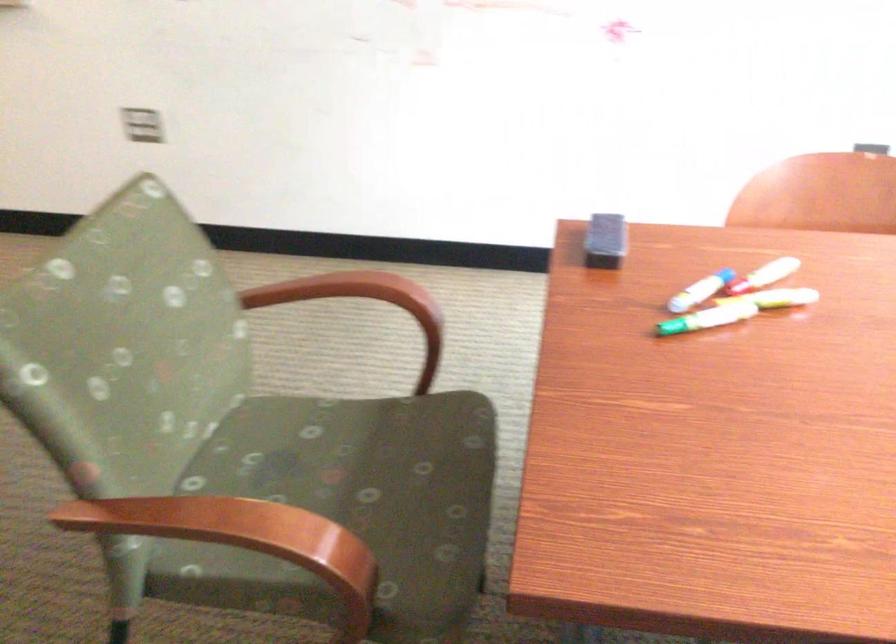
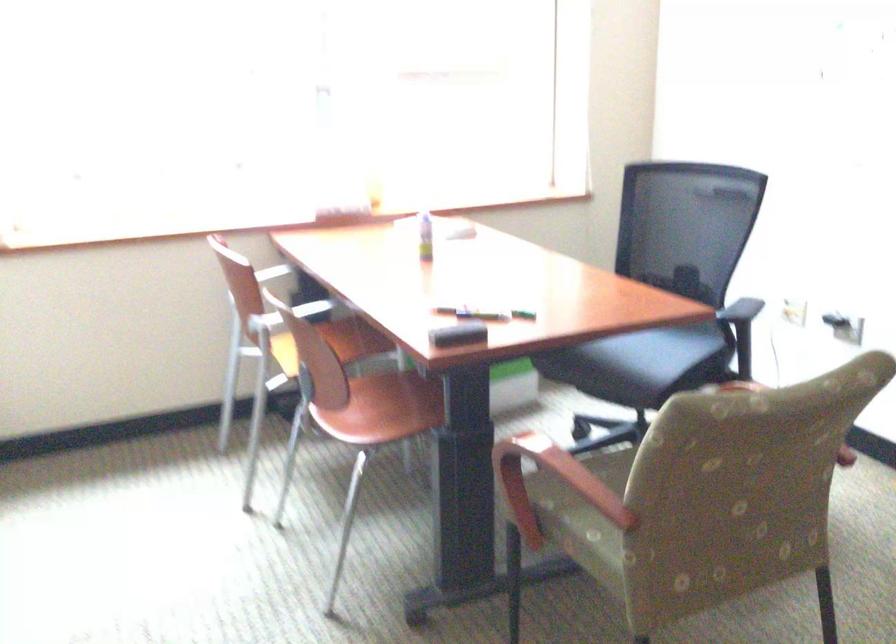
Question: I am providing you with two images of the same scene from different viewpoints. After the viewpoint changes to image2, which objects are now occluded?

Choices:
 (A) top book
 (B) chair sitting surface
 (C) black board eraser
 (D) wooden chair armrest

Answer: (D)